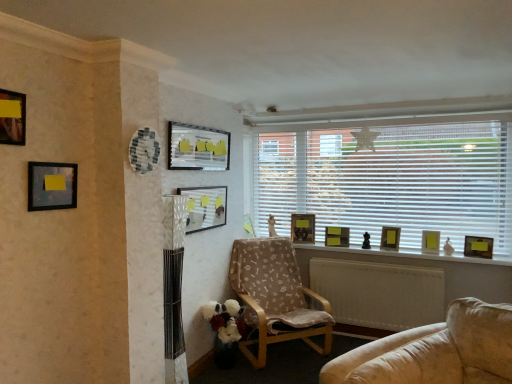
Locate an element on the screen. blank space above white blinds at upper right (from a real-world perspective) is located at coordinates (372, 110).